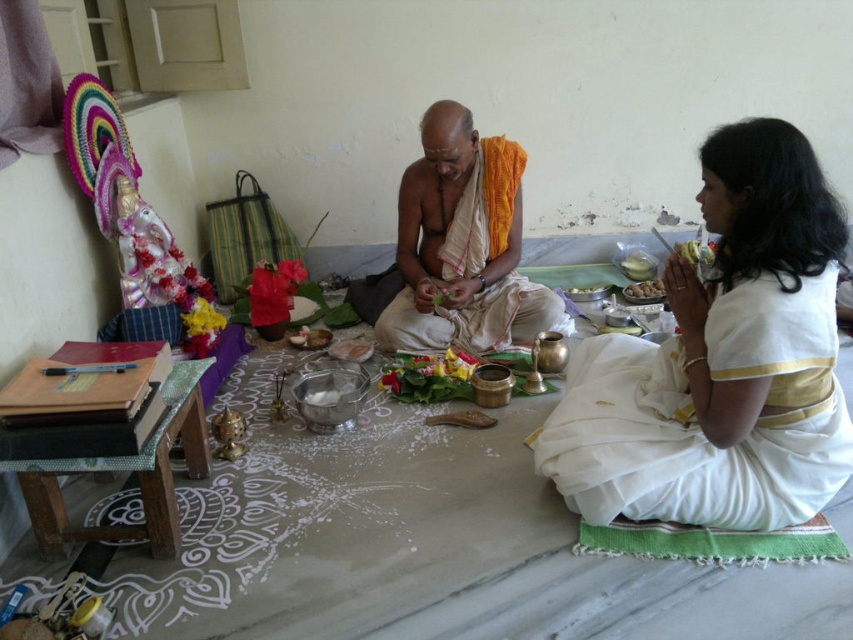
Question: Which of the following is the farthest from the observer?

Choices:
 (A) (317, 333)
 (B) (689, 246)

Answer: (B)

Question: Which point is farther from the camera taking this photo?

Choices:
 (A) (305, 326)
 (B) (491, 163)
 (C) (635, 252)
 (D) (602, 296)

Answer: (C)

Question: Which object is positioned farthest from the brown matte food at center?

Choices:
 (A) smooth golden plate at center
 (B) yellow matte banana at right

Answer: (B)

Question: Is the position of white silk saree at lower right less distant than that of yellow matte banana at right?

Choices:
 (A) yes
 (B) no

Answer: (A)

Question: Is smooth golden plate at center to the left of smooth brown rice at center from the viewer's perspective?

Choices:
 (A) no
 (B) yes

Answer: (A)

Question: Is smooth golden plate at center above brown matte food at center?

Choices:
 (A) yes
 (B) no

Answer: (A)